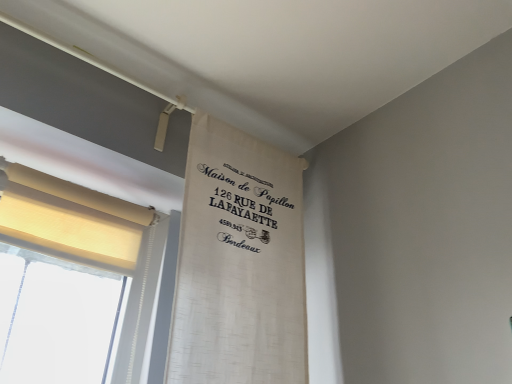
Question: Is there a large distance between beige fabric curtain at left, which ranks as the first curtain in left-to-right order, and white woven curtain at upper center, the 2th curtain in the left-to-right sequence?

Choices:
 (A) yes
 (B) no

Answer: (B)

Question: From the image's perspective, is beige fabric curtain at left, which ranks as the first curtain in left-to-right order, below white woven curtain at upper center, the 2th curtain in the left-to-right sequence?

Choices:
 (A) yes
 (B) no

Answer: (B)

Question: Is beige fabric curtain at left, arranged as the 2th curtain when viewed from the right, facing towards white woven curtain at upper center, positioned as the first curtain in right-to-left order?

Choices:
 (A) no
 (B) yes

Answer: (A)

Question: Considering the relative sizes of beige fabric curtain at left, arranged as the 2th curtain when viewed from the right, and white woven curtain at upper center, the 2th curtain in the left-to-right sequence, in the image provided, is beige fabric curtain at left, arranged as the 2th curtain when viewed from the right, wider than white woven curtain at upper center, the 2th curtain in the left-to-right sequence,?

Choices:
 (A) no
 (B) yes

Answer: (B)

Question: Is beige fabric curtain at left, which ranks as the first curtain in left-to-right order, outside of white woven curtain at upper center, the 2th curtain in the left-to-right sequence?

Choices:
 (A) no
 (B) yes

Answer: (B)

Question: Is the position of beige fabric curtain at left, which ranks as the first curtain in left-to-right order, less distant than that of white woven curtain at upper center, positioned as the first curtain in right-to-left order?

Choices:
 (A) yes
 (B) no

Answer: (B)

Question: Does white woven curtain at upper center, positioned as the first curtain in right-to-left order, have a lesser width compared to beige fabric curtain at left, which ranks as the first curtain in left-to-right order?

Choices:
 (A) no
 (B) yes

Answer: (B)

Question: From a real-world perspective, does white woven curtain at upper center, the 2th curtain in the left-to-right sequence, sit lower than beige fabric curtain at left, arranged as the 2th curtain when viewed from the right?

Choices:
 (A) no
 (B) yes

Answer: (A)

Question: Is white woven curtain at upper center, the 2th curtain in the left-to-right sequence, with beige fabric curtain at left, arranged as the 2th curtain when viewed from the right?

Choices:
 (A) yes
 (B) no

Answer: (B)

Question: From the image's perspective, is white woven curtain at upper center, positioned as the first curtain in right-to-left order, under beige fabric curtain at left, arranged as the 2th curtain when viewed from the right?

Choices:
 (A) no
 (B) yes

Answer: (B)

Question: Is white woven curtain at upper center, positioned as the first curtain in right-to-left order, not inside beige fabric curtain at left, which ranks as the first curtain in left-to-right order?

Choices:
 (A) yes
 (B) no

Answer: (A)

Question: Are white woven curtain at upper center, the 2th curtain in the left-to-right sequence, and beige fabric curtain at left, arranged as the 2th curtain when viewed from the right, far apart?

Choices:
 (A) no
 (B) yes

Answer: (A)

Question: Is beige fabric curtain at left, arranged as the 2th curtain when viewed from the right, in front of or behind white woven curtain at upper center, positioned as the first curtain in right-to-left order, in the image?

Choices:
 (A) front
 (B) behind

Answer: (B)